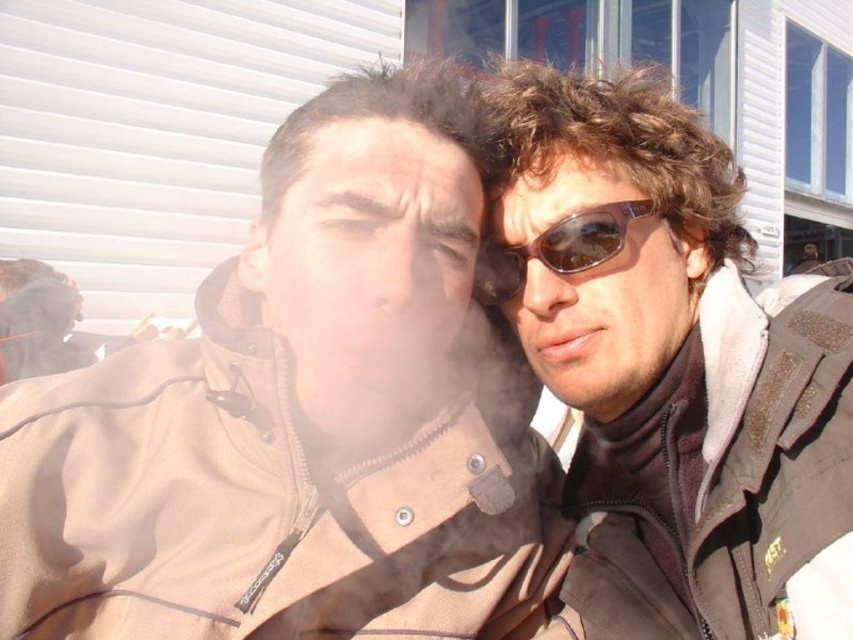
Between point (347, 508) and point (482, 280), which one is positioned in front?

Point (347, 508) is more forward.

Does brown soft jacket at center have a larger size compared to brown reflective sunglasses at right?

Yes, brown soft jacket at center is bigger than brown reflective sunglasses at right.

Identify the location of brown soft jacket at center. (299, 420).

Which is below, brown soft jacket at center or sunglasses at right?

brown soft jacket at center is lower down.

Which is behind, point (322, 566) or point (824, 602)?

The point (322, 566) is behind.

Is point (321, 202) in front of point (669, 323)?

That is True.

Find the location of `brown soft jacket at center`. brown soft jacket at center is located at coordinates (299, 420).

Does sunglasses at right have a smaller size compared to brown reflective sunglasses at right?

Incorrect, sunglasses at right is not smaller in size than brown reflective sunglasses at right.

Can you confirm if sunglasses at right is positioned to the left of brown reflective sunglasses at right?

No, sunglasses at right is not to the left of brown reflective sunglasses at right.

Who is more forward, [689,291] or [498,244]?

Positioned in front is point [498,244].

Where is `sunglasses at right`? This screenshot has height=640, width=853. sunglasses at right is located at coordinates (672, 369).